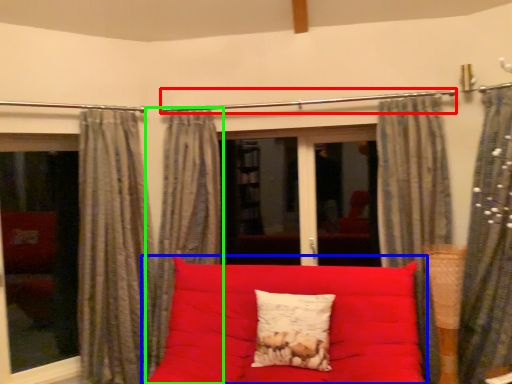
Question: Which object is the closest to the clothesline (highlighted by a red box)? Choose among these: studio couch (highlighted by a blue box) or curtain (highlighted by a green box).

Choices:
 (A) studio couch
 (B) curtain

Answer: (B)